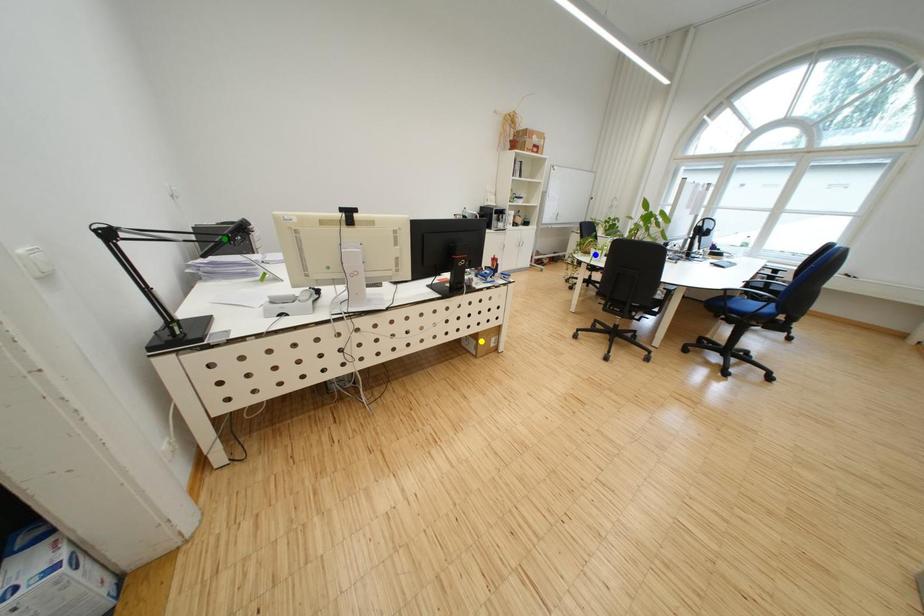
Order these from nearest to farthest:
1. yellow point
2. blue point
3. green point

green point, yellow point, blue point